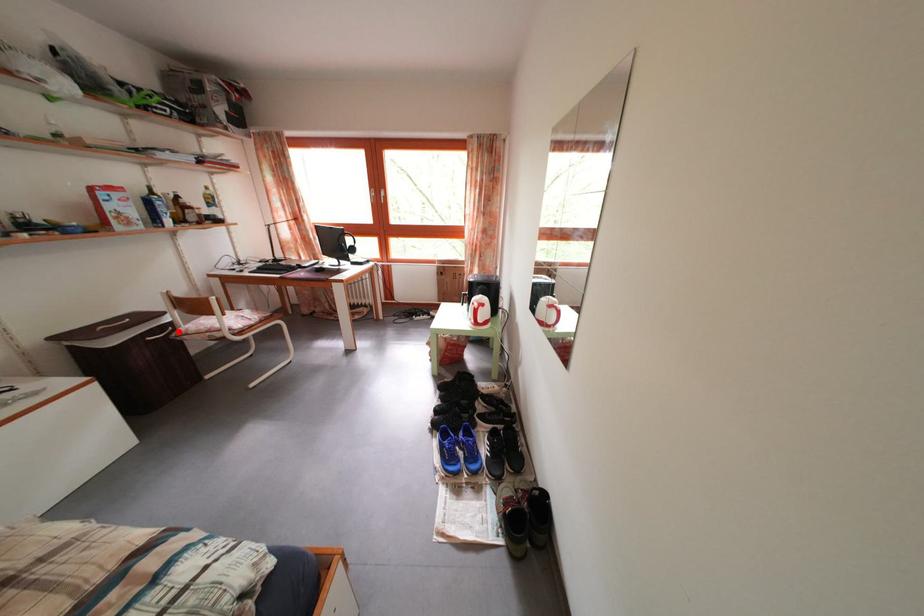
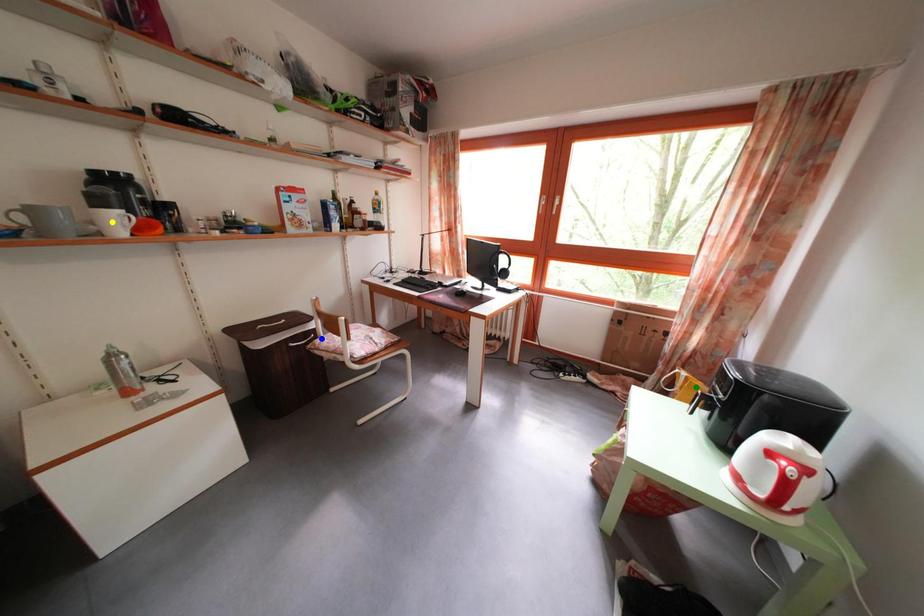
Question: I am providing you with two images of the same scene from different viewpoints. A red point is marked on the first image. You are given multiple points on the second image. Can you choose the point in image 2 that corresponds to the point in image 1?

Choices:
 (A) yellow point
 (B) blue point
 (C) green point

Answer: (B)